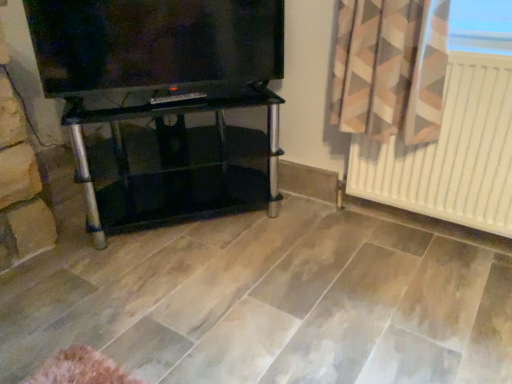
Question: Considering the relative sizes of black glass tv stand at center and matte black tv at upper left in the image provided, is black glass tv stand at center thinner than matte black tv at upper left?

Choices:
 (A) no
 (B) yes

Answer: (A)

Question: Does black glass tv stand at center have a smaller size compared to matte black tv at upper left?

Choices:
 (A) yes
 (B) no

Answer: (B)

Question: Is black glass tv stand at center facing away from matte black tv at upper left?

Choices:
 (A) yes
 (B) no

Answer: (B)

Question: Is black glass tv stand at center not within matte black tv at upper left?

Choices:
 (A) yes
 (B) no

Answer: (A)

Question: Is black glass tv stand at center aimed at matte black tv at upper left?

Choices:
 (A) yes
 (B) no

Answer: (B)

Question: Are black glass tv stand at center and matte black tv at upper left far apart?

Choices:
 (A) yes
 (B) no

Answer: (B)

Question: Could white matte radiator at right be considered to be inside matte black tv at upper left?

Choices:
 (A) no
 (B) yes

Answer: (A)

Question: Does matte black tv at upper left turn towards white matte radiator at right?

Choices:
 (A) yes
 (B) no

Answer: (B)

Question: Is matte black tv at upper left taller than white matte radiator at right?

Choices:
 (A) yes
 (B) no

Answer: (B)

Question: Is matte black tv at upper left facing away from white matte radiator at right?

Choices:
 (A) no
 (B) yes

Answer: (A)

Question: Can you confirm if matte black tv at upper left is positioned to the right of white matte radiator at right?

Choices:
 (A) no
 (B) yes

Answer: (A)

Question: Can you confirm if matte black tv at upper left is smaller than white matte radiator at right?

Choices:
 (A) yes
 (B) no

Answer: (A)

Question: Is black glass tv stand at center facing towards white matte radiator at right?

Choices:
 (A) yes
 (B) no

Answer: (B)